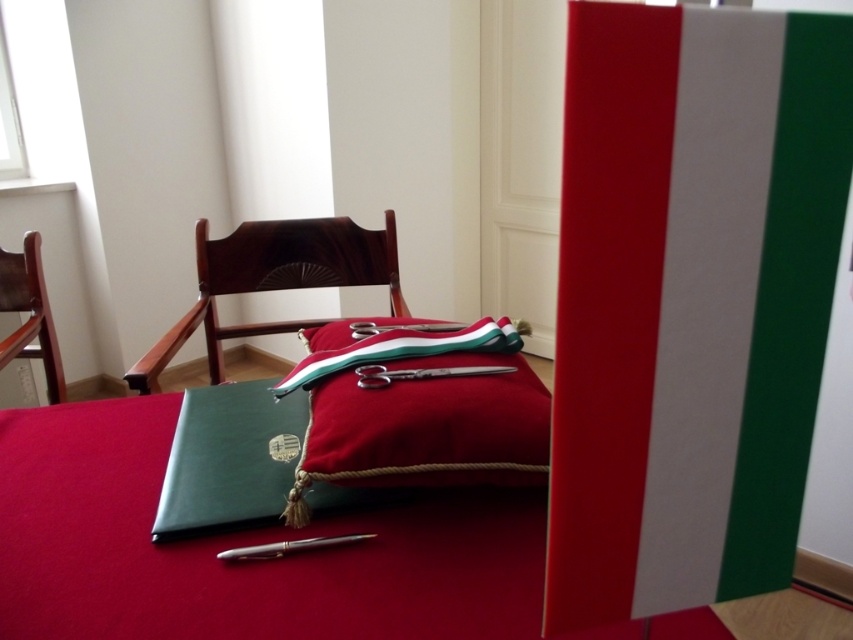
Question: In this image, where is velvet red cushion at center located relative to wooden chair at left?

Choices:
 (A) right
 (B) left

Answer: (A)

Question: Which object appears closest to the camera in this image?

Choices:
 (A) velvet red pillow at center
 (B) wooden chair at left
 (C) mahogany wood rocking chair at center
 (D) silver metallic pen at lower center

Answer: (D)

Question: Is velvet red pillow at center above velvet red cushion at center?

Choices:
 (A) yes
 (B) no

Answer: (B)

Question: Which point is closer to the camera?

Choices:
 (A) (460, 436)
 (B) (453, 342)
 (C) (189, 310)

Answer: (A)

Question: Is the position of velvet red pillow at center more distant than that of mahogany wood rocking chair at center?

Choices:
 (A) no
 (B) yes

Answer: (A)

Question: Which of the following is the closest to the observer?

Choices:
 (A) (209, 280)
 (B) (338, 413)
 (C) (483, 337)
 (D) (267, 557)

Answer: (D)